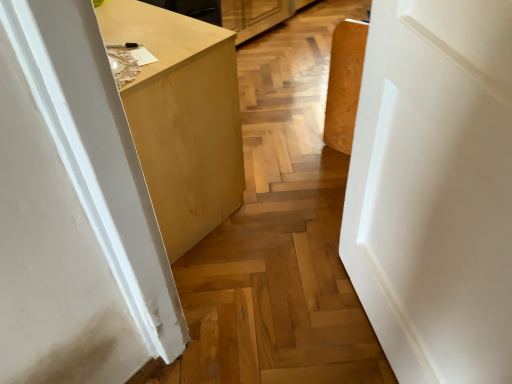
Find the location of a particular element. The image size is (512, 384). vacant space underneath white matte door at center (from a real-world perspective) is located at coordinates (359, 322).